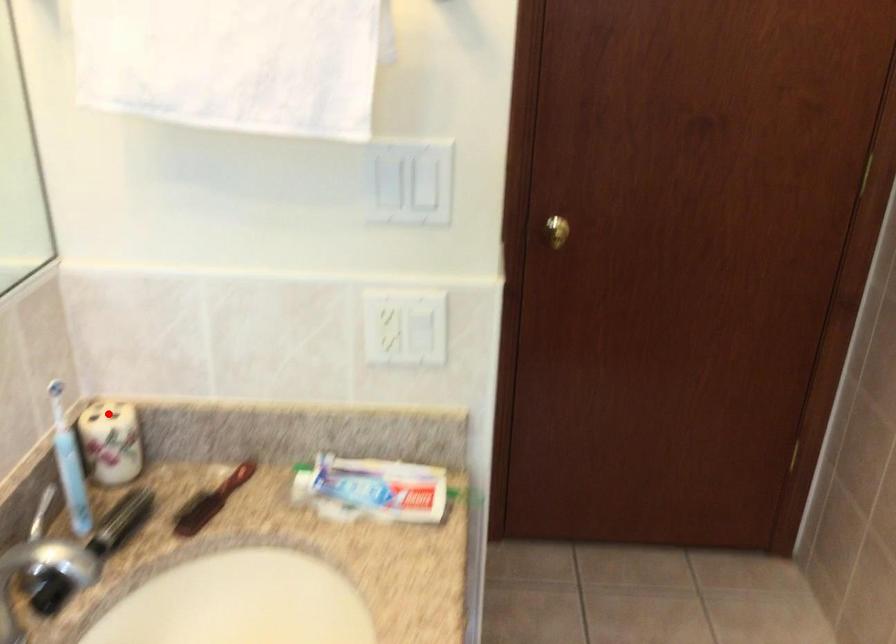
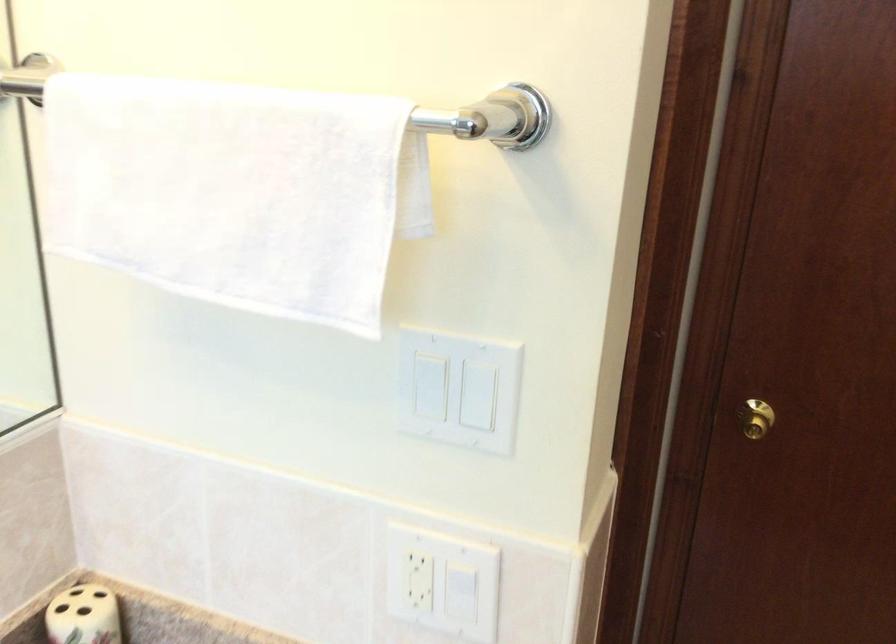
Question: I am providing you with two images of the same scene from different viewpoints. A red point is shown in image1. For the corresponding object point in image2, is it positioned nearer or farther from the camera?

Choices:
 (A) Nearer
 (B) Farther

Answer: (A)